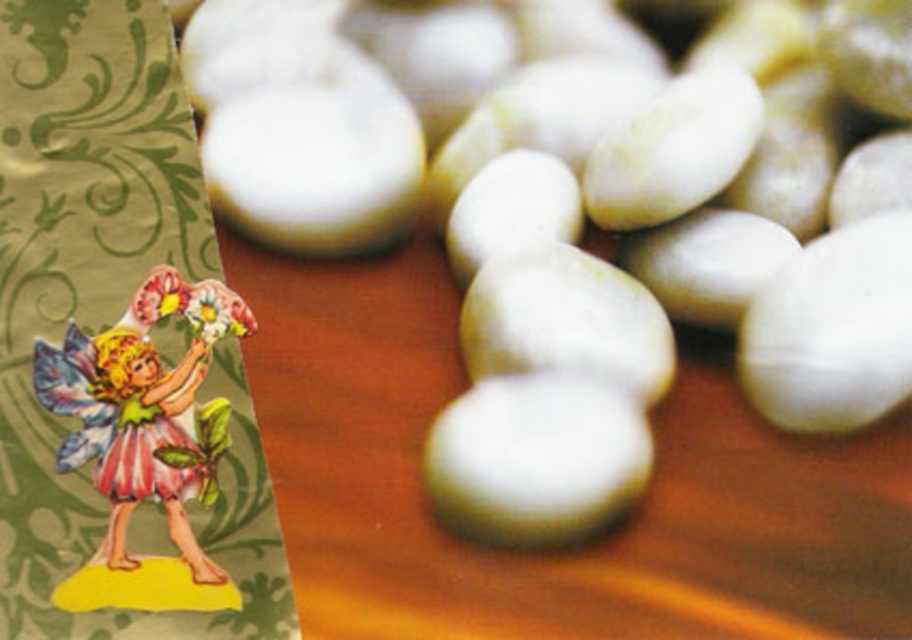
Can you confirm if white smooth stone at left is positioned below pastel paper fairy at left?

Incorrect, white smooth stone at left is not positioned below pastel paper fairy at left.

At what (x,y) coordinates should I click in order to perform the action: click on white smooth stone at left. Please return your answer as a coordinate pair (x, y). The image size is (912, 640). Looking at the image, I should click on (579, 332).

At what (x,y) coordinates should I click in order to perform the action: click on white smooth stone at left. Please return your answer as a coordinate pair (x, y). This screenshot has width=912, height=640. Looking at the image, I should click on [579, 332].

Looking at this image, can you confirm if white smooth stone at left is smaller than paper fairy at left?

Actually, white smooth stone at left might be larger than paper fairy at left.

Based on the photo, measure the distance between white smooth stone at left and camera.

white smooth stone at left is 32.78 inches away from camera.

The image size is (912, 640). I want to click on white smooth stone at left, so click(x=579, y=332).

Is paper fairy at left above pastel paper fairy at left?

Actually, paper fairy at left is below pastel paper fairy at left.

Who is taller, paper fairy at left or pastel paper fairy at left?

paper fairy at left is taller.

Does point (112, 428) lie behind point (185, 291)?

No, (112, 428) is in front of (185, 291).

Where is `paper fairy at left`? paper fairy at left is located at coordinates [144, 410].